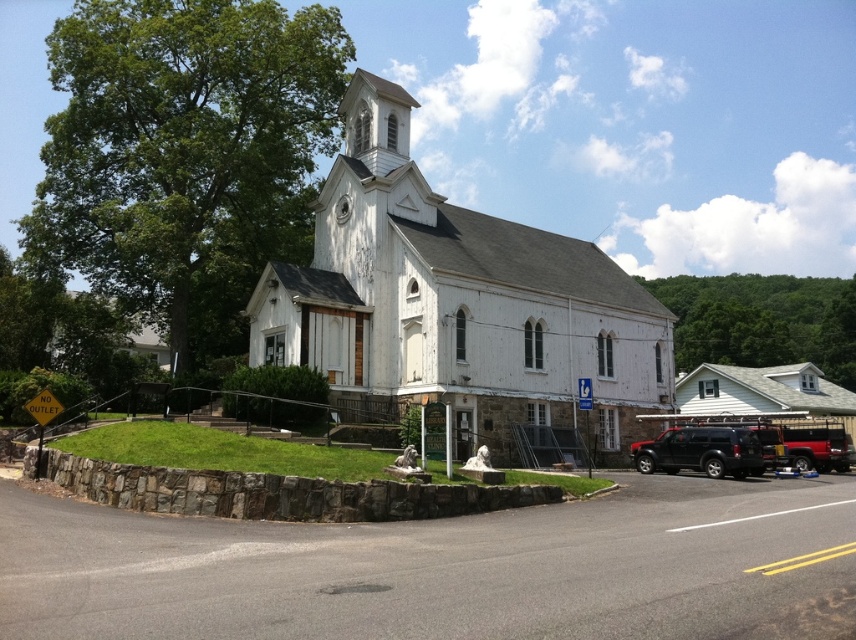
Which is more to the left, white wooden church at center or black matte suv at lower right?

white wooden church at center is more to the left.

Is point (480, 310) positioned behind point (739, 458)?

Yes.

Between point (551, 416) and point (669, 428), which one is positioned in front?

Point (551, 416) is in front.

You are a GUI agent. You are given a task and a screenshot of the screen. Output one action in this format:
    pyautogui.click(x=<x>, y=<y>)
    Task: Click on the white wooden church at center
    
    Given the screenshot: What is the action you would take?
    pyautogui.click(x=456, y=301)

Does white wooden church at center have a lesser width compared to metallic red suv at lower right?

In fact, white wooden church at center might be wider than metallic red suv at lower right.

What do you see at coordinates (456, 301) in the screenshot?
I see `white wooden church at center` at bounding box center [456, 301].

Find the location of a particular element. The width and height of the screenshot is (856, 640). white wooden church at center is located at coordinates (456, 301).

Between point (742, 461) and point (839, 444), which one is positioned behind?

Point (839, 444)

Can you confirm if black matte suv at lower right is positioned to the right of metallic red suv at lower right?

No, black matte suv at lower right is not to the right of metallic red suv at lower right.

Based on the photo, who is more distant from viewer, (x=670, y=429) or (x=813, y=451)?

The point (x=813, y=451) is behind.

Identify the location of black matte suv at lower right. (700, 451).